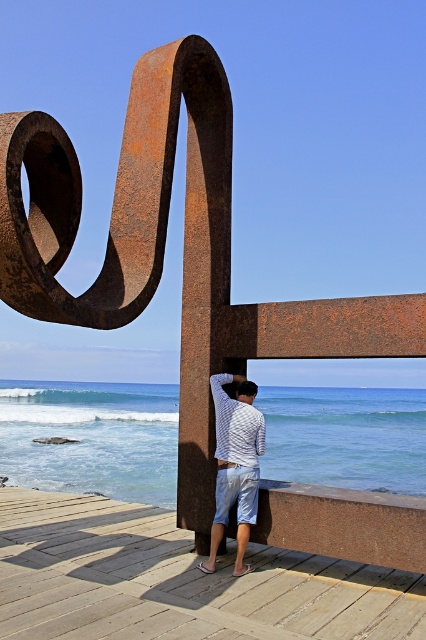
Can you confirm if rustic wood dock at lower center is positioned above white striped shirt at center?

Incorrect, rustic wood dock at lower center is not positioned above white striped shirt at center.

This screenshot has height=640, width=426. Find the location of `rustic wood dock at lower center`. rustic wood dock at lower center is located at coordinates (178, 580).

Who is shorter, rustic wood dock at lower center or blue water at lower center?

rustic wood dock at lower center is shorter.

Who is higher up, rustic wood dock at lower center or blue water at lower center?

Positioned higher is rustic wood dock at lower center.

Find the location of a particular element. Image resolution: width=426 pixels, height=640 pixels. rustic wood dock at lower center is located at coordinates (178, 580).

Who is positioned more to the left, blue water at lower center or white striped shirt at center?

white striped shirt at center

Can you confirm if blue water at lower center is positioned below white striped shirt at center?

Yes, blue water at lower center is below white striped shirt at center.

Find the location of a particular element. The width and height of the screenshot is (426, 640). blue water at lower center is located at coordinates pyautogui.click(x=92, y=436).

The width and height of the screenshot is (426, 640). I want to click on blue water at lower center, so click(92, 436).